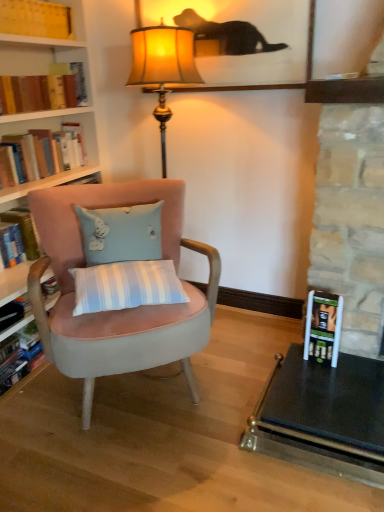
Question: Can you confirm if hardcover book at left, marked as the 5th book in a top-to-bottom arrangement, is taller than hardcover books at left, the 3th book from the bottom?

Choices:
 (A) no
 (B) yes

Answer: (A)

Question: Is hardcover book at left, which is counted as the first book, starting from the bottom, thinner than hardcover books at left, positioned as the third book in top-to-bottom order?

Choices:
 (A) no
 (B) yes

Answer: (A)

Question: Can you see hardcover book at left, marked as the 5th book in a top-to-bottom arrangement, touching hardcover books at left, the 3th book from the bottom?

Choices:
 (A) yes
 (B) no

Answer: (B)

Question: From a real-world perspective, is hardcover book at left, marked as the 5th book in a top-to-bottom arrangement, over hardcover books at left, positioned as the third book in top-to-bottom order?

Choices:
 (A) yes
 (B) no

Answer: (B)

Question: Considering the relative sizes of hardcover book at left, which is counted as the first book, starting from the bottom, and hardcover books at left, positioned as the third book in top-to-bottom order, in the image provided, is hardcover book at left, which is counted as the first book, starting from the bottom, bigger than hardcover books at left, positioned as the third book in top-to-bottom order,?

Choices:
 (A) no
 (B) yes

Answer: (A)

Question: From a real-world perspective, is hardcover book at left, arranged as the second book when ordered from the bottom, positioned above or below hardcover books at left, positioned as the third book in top-to-bottom order?

Choices:
 (A) below
 (B) above

Answer: (A)

Question: Considering the positions of point (29, 233) and point (48, 166), is point (29, 233) closer or farther from the camera than point (48, 166)?

Choices:
 (A) farther
 (B) closer

Answer: (B)

Question: Considering the positions of hardcover book at left, arranged as the second book when ordered from the bottom, and hardcover books at left, the 3th book from the bottom, in the image, is hardcover book at left, arranged as the second book when ordered from the bottom, bigger or smaller than hardcover books at left, the 3th book from the bottom,?

Choices:
 (A) big
 (B) small

Answer: (B)

Question: Is hardcover book at left, arranged as the second book when ordered from the bottom, to the left or to the right of hardcover books at left, positioned as the third book in top-to-bottom order, in the image?

Choices:
 (A) left
 (B) right

Answer: (A)

Question: From the image's perspective, is hardcover book at left, the second book positioned from the top, positioned above or below hardcover books at left, the 3th book from the bottom?

Choices:
 (A) below
 (B) above

Answer: (B)

Question: Considering the positions of hardcover book at left, the second book positioned from the top, and hardcover books at left, positioned as the third book in top-to-bottom order, in the image, is hardcover book at left, the second book positioned from the top, taller or shorter than hardcover books at left, positioned as the third book in top-to-bottom order,?

Choices:
 (A) short
 (B) tall

Answer: (A)

Question: From a real-world perspective, is hardcover book at left, which ranks as the 4th book in bottom-to-top order, positioned above or below hardcover books at left, positioned as the third book in top-to-bottom order?

Choices:
 (A) above
 (B) below

Answer: (A)

Question: In terms of size, does hardcover book at left, the second book positioned from the top, appear bigger or smaller than hardcover books at left, positioned as the third book in top-to-bottom order?

Choices:
 (A) big
 (B) small

Answer: (B)

Question: Is hardcover book at lower right to the left or to the right of yellow paper book at upper left, the fifth book in the bottom-to-top sequence, in the image?

Choices:
 (A) right
 (B) left

Answer: (A)

Question: Is point (332, 365) positioned closer to the camera than point (52, 10)?

Choices:
 (A) farther
 (B) closer

Answer: (B)